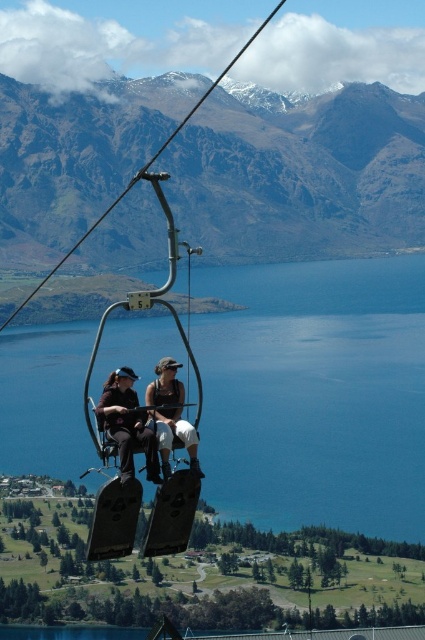
Based on the photo, you are on a chairlift ride and want to know how far the point at coordinates (299, 212) is from your current position. Can you determine the distance?

The point at coordinates (299, 212) is 649.77 meters away from your current position.